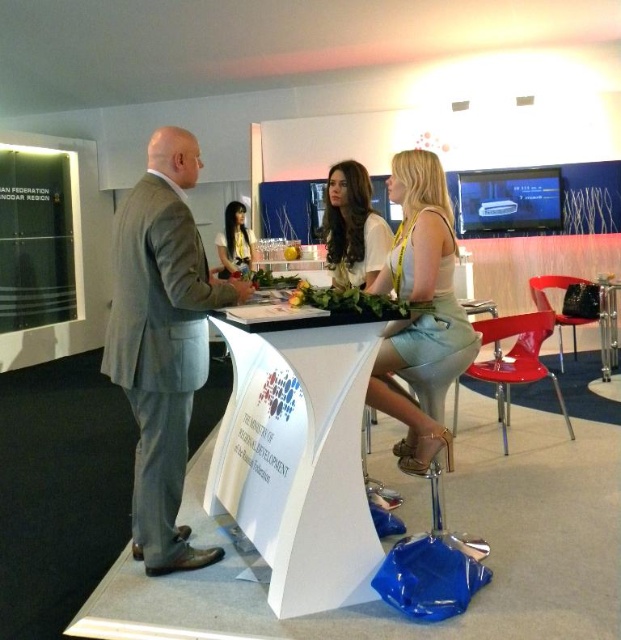
Question: Is light blue fabric dress at center positioned before clear acrylic table at center?

Choices:
 (A) yes
 (B) no

Answer: (A)

Question: Observing the image, what is the correct spatial positioning of white glossy table at center in reference to white fabric dress at center?

Choices:
 (A) left
 (B) right

Answer: (A)

Question: Which point is closer to the camera?

Choices:
 (A) (138, 474)
 (B) (337, 208)
 (C) (233, 273)

Answer: (A)

Question: Which point appears farthest from the camera in this image?

Choices:
 (A) (229, 218)
 (B) (391, 401)

Answer: (A)

Question: Does light gray suit at left come behind white fabric dress at center?

Choices:
 (A) yes
 (B) no

Answer: (B)

Question: Based on their relative distances, which object is farther from the light blue fabric dress at center?

Choices:
 (A) smooth white blouse at center
 (B) light gray suit at left
 (C) white fabric dress at center

Answer: (A)